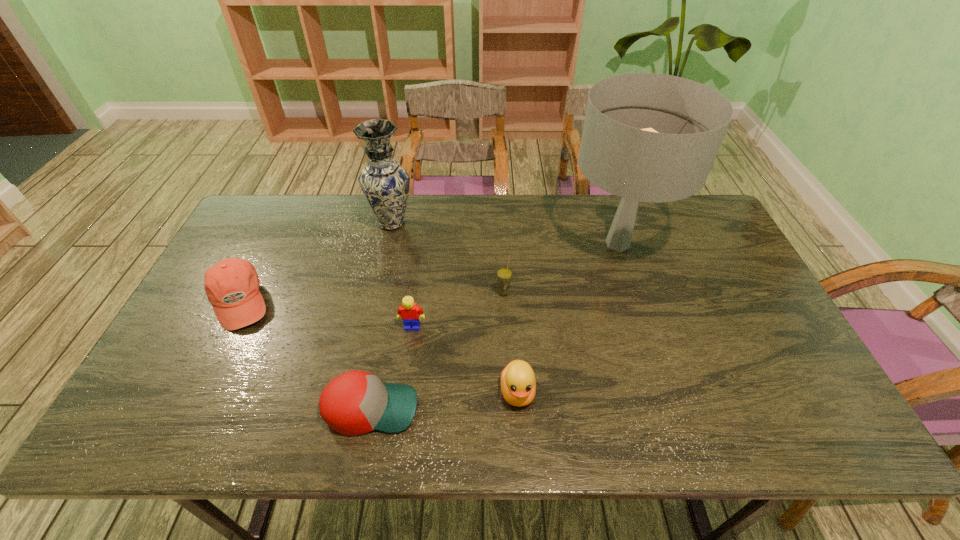
Where is `the tallest object`? the tallest object is located at coordinates tap(648, 137).

I want to click on the rightmost object, so click(648, 137).

Image resolution: width=960 pixels, height=540 pixels. I want to click on vase, so click(x=385, y=184).

You are a GUI agent. You are given a task and a screenshot of the screen. Output one action in this format:
    pyautogui.click(x=<x>, y=<y>)
    Task: Click on the straw for drinking
    
    Given the screenshot: What is the action you would take?
    pyautogui.click(x=504, y=274)

Where is `Lego`? The width and height of the screenshot is (960, 540). Lego is located at coordinates (409, 312).

Locate an element on the screen. The height and width of the screenshot is (540, 960). the farther baseball cap is located at coordinates (232, 285).

The height and width of the screenshot is (540, 960). What are the coordinates of `the taller baseball cap` in the screenshot? It's located at (232, 285).

Find the location of a particular element. The image size is (960, 540). duckling is located at coordinates (518, 384).

At what (x,y) coordinates should I click in order to perform the action: click on the shortest object. Please return your answer as a coordinate pair (x, y). Looking at the image, I should click on (356, 402).

I want to click on the nearer baseball cap, so click(356, 402).